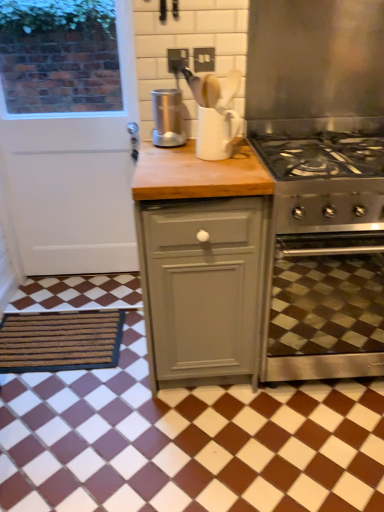
You are a GUI agent. You are given a task and a screenshot of the screen. Output one action in this format:
    pyautogui.click(x=<x>, y=<y>)
    Task: Click on the empty space that is ontop of brown textured mat at lower left (from a real-world perspective)
    This screenshot has height=512, width=384.
    Given the screenshot: What is the action you would take?
    pyautogui.click(x=54, y=332)